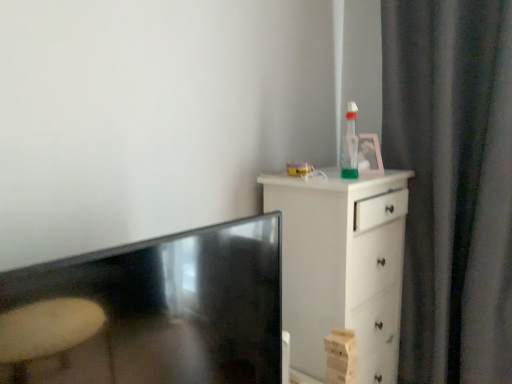
Question: From a real-world perspective, is matte black tv at lower left on top of white wood chest of drawers at right?

Choices:
 (A) no
 (B) yes

Answer: (B)

Question: Is the depth of matte black tv at lower left greater than that of white wood chest of drawers at right?

Choices:
 (A) yes
 (B) no

Answer: (B)

Question: Would you say matte black tv at lower left is outside white wood chest of drawers at right?

Choices:
 (A) no
 (B) yes

Answer: (B)

Question: Is matte black tv at lower left closer to camera compared to white wood chest of drawers at right?

Choices:
 (A) yes
 (B) no

Answer: (A)

Question: From the image's perspective, is matte black tv at lower left below white wood chest of drawers at right?

Choices:
 (A) no
 (B) yes

Answer: (A)

Question: Considering the relative sizes of matte black tv at lower left and white wood chest of drawers at right in the image provided, is matte black tv at lower left smaller than white wood chest of drawers at right?

Choices:
 (A) yes
 (B) no

Answer: (A)

Question: Could you tell me if white wood chest of drawers at right is turned towards dark gray fabric curtain at right?

Choices:
 (A) no
 (B) yes

Answer: (B)

Question: From the image's perspective, is white wood chest of drawers at right over dark gray fabric curtain at right?

Choices:
 (A) no
 (B) yes

Answer: (A)

Question: From the image's perspective, is white wood chest of drawers at right located beneath dark gray fabric curtain at right?

Choices:
 (A) no
 (B) yes

Answer: (B)

Question: Is white wood chest of drawers at right looking in the opposite direction of dark gray fabric curtain at right?

Choices:
 (A) no
 (B) yes

Answer: (A)

Question: Considering the relative sizes of white wood chest of drawers at right and dark gray fabric curtain at right in the image provided, is white wood chest of drawers at right wider than dark gray fabric curtain at right?

Choices:
 (A) yes
 (B) no

Answer: (A)

Question: Is white wood chest of drawers at right next to dark gray fabric curtain at right?

Choices:
 (A) yes
 (B) no

Answer: (B)

Question: From the image's perspective, does dark gray fabric curtain at right appear lower than white wood chest of drawers at right?

Choices:
 (A) no
 (B) yes

Answer: (A)